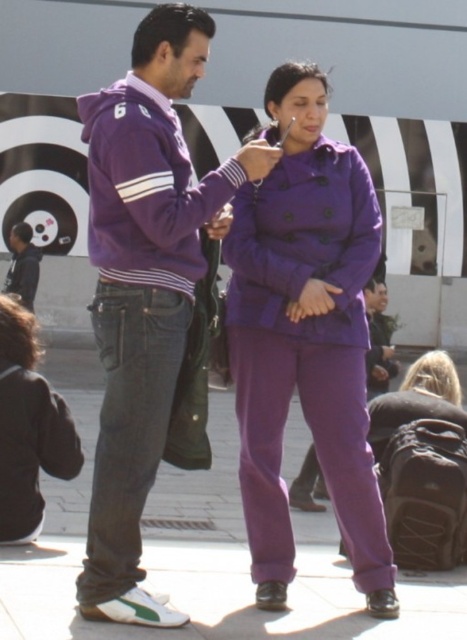
You are a fashion designer observing two people in the plaza. The purple woolen coat at center and the purple cotton hoodie at left are both part of your inspiration. Which clothing item is positioned lower in the image?

The purple woolen coat at center is positioned lower than the purple cotton hoodie at left in the image.

You are a fashion designer observing two models wearing purple coats in the plaza. The models are standing in front of a modern building. You need to determine which model is wearing the taller garment. The garments are labeled as the purple woolen coat at center and the purple matte jacket at center. Which one is taller?

The purple woolen coat at center is taller than the purple matte jacket at center.

You are a photographer trying to capture a candid shot of the person in the purple double breasted coat at right. The camera you are using has a limited field of view. You notice a point at coordinate (x=144, y=285) on the purple cotton hoodie at left. Will this point be within your camera frame if you are focused on the purple double breasted coat at right?

The point at coordinate (x=144, y=285) is on the purple cotton hoodie at left. Since the camera is focused on the purple double breasted coat at right, the point on the purple cotton hoodie at left may not be within the camera frame unless the field of view is wide enough to include both subjects. However, without knowing the exact field of view angle, it is impossible to definitively determine if the point is within the frame.